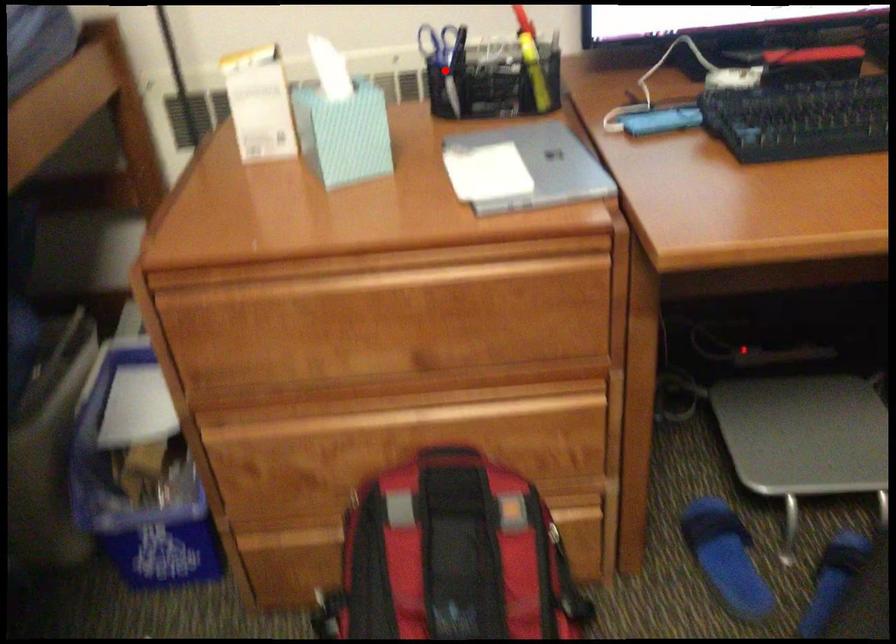
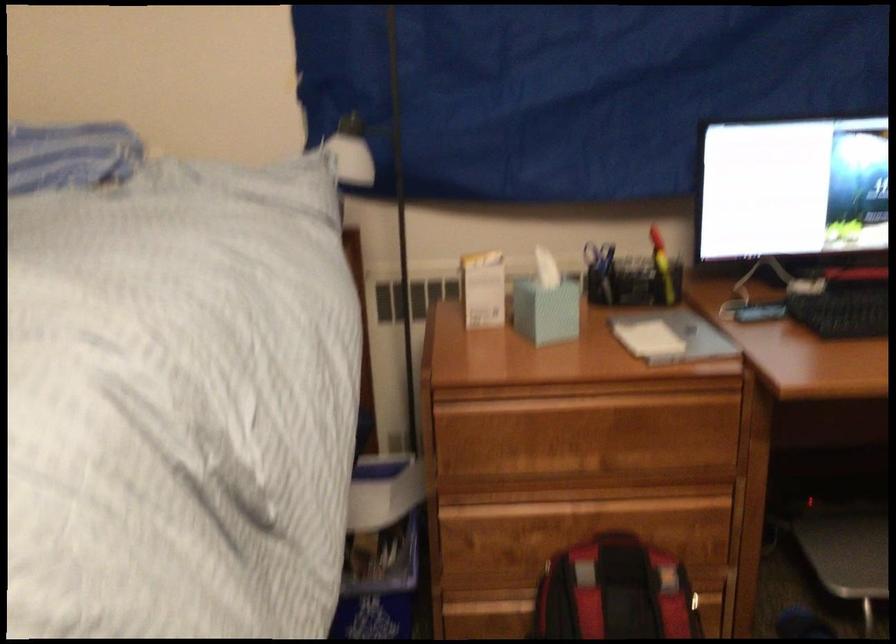
Where in the second image is the point corresponding to the highlighted location from the first image?

(599, 272)